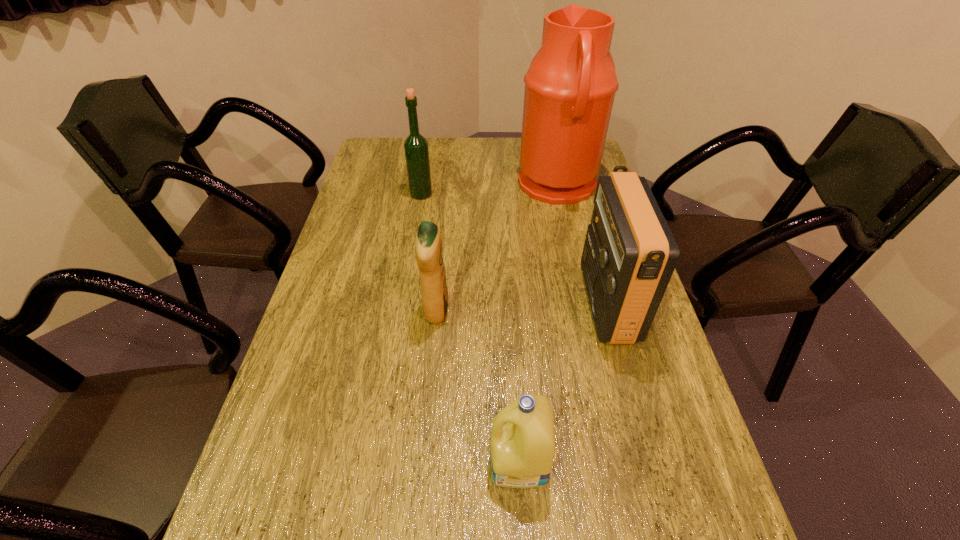
Identify the location of water jug. The image size is (960, 540). (570, 87).

Where is `liquor`? The image size is (960, 540). liquor is located at coordinates (416, 150).

The height and width of the screenshot is (540, 960). I want to click on radio receiver, so click(629, 255).

The width and height of the screenshot is (960, 540). In order to click on the taller detergent in this screenshot , I will do `click(428, 247)`.

In order to click on the left detergent in this screenshot , I will do `click(428, 247)`.

Image resolution: width=960 pixels, height=540 pixels. Identify the location of the shortest object. (522, 449).

Where is `the shorter detergent`? the shorter detergent is located at coordinates (522, 449).

I want to click on vacant space located 0.250m from the spout of the tallest object, so click(x=445, y=186).

Identify the location of vacant region located from the spout of the tallest object. (434, 186).

Where is `free space located 0.130m from the spout of the tallest object`? The image size is (960, 540). free space located 0.130m from the spout of the tallest object is located at coordinates (480, 186).